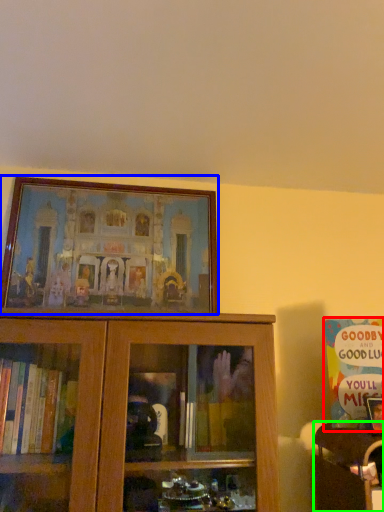
Question: Which object is the closest to the book (highlighted by a red box)? Choose among these: picture frame (highlighted by a blue box) or furniture (highlighted by a green box).

Choices:
 (A) picture frame
 (B) furniture

Answer: (B)